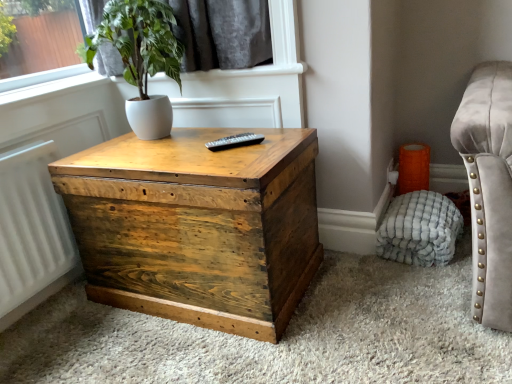
At what (x,y) coordinates should I click in order to perform the action: click on free location in front of white matte pot at upper left. Please return your answer as a coordinate pair (x, y). Looking at the image, I should click on (157, 159).